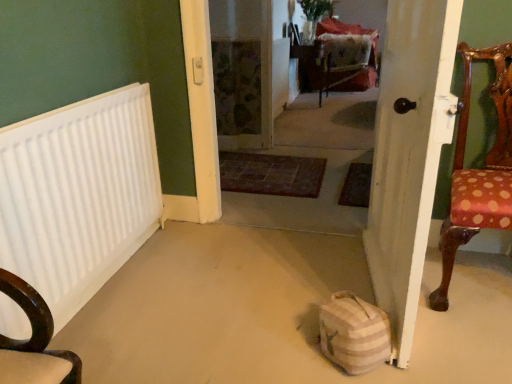
This screenshot has height=384, width=512. Identify the location of free region under polka dot fabric chair at right (from a real-world perspective). (475, 279).